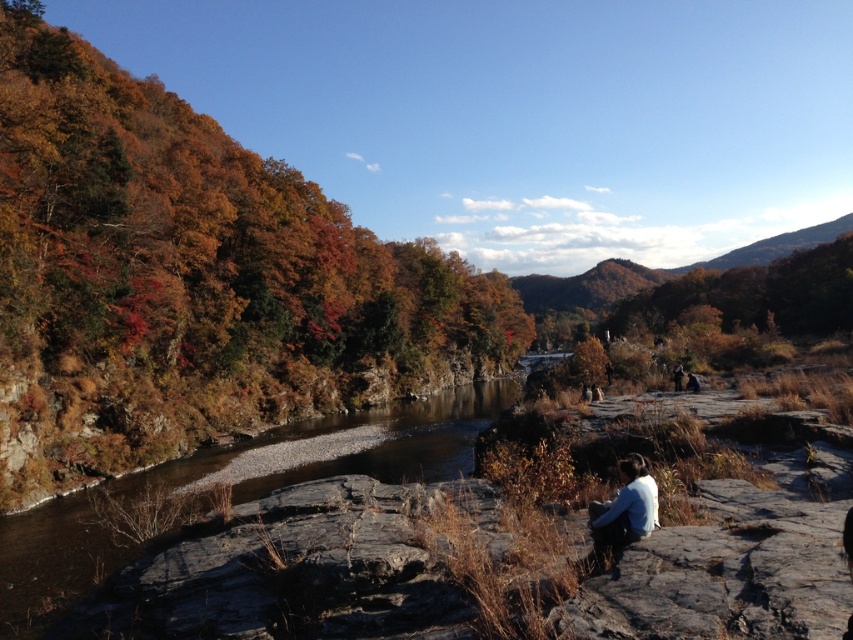
Between brown rocky creek at center and white cotton shirt at lower center, which one is positioned lower?

brown rocky creek at center

Is brown rocky creek at center smaller than white cotton shirt at lower center?

No, brown rocky creek at center is not smaller than white cotton shirt at lower center.

Is point (260, 477) positioned behind point (598, 534)?

Yes.

Identify the location of brown rocky creek at center. (235, 490).